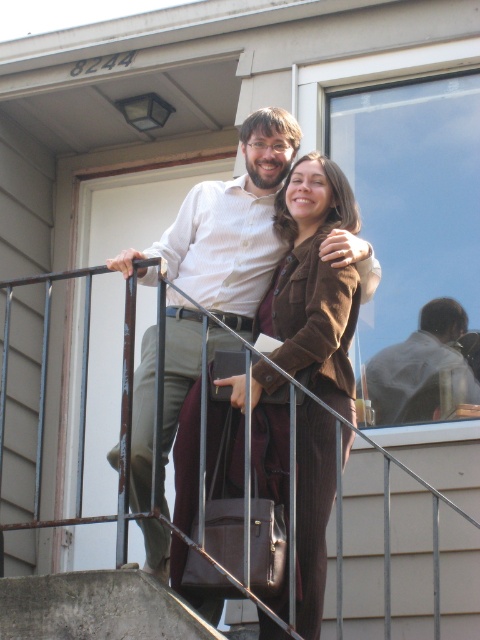
Question: Is brown woolen suit at center bigger than light brown leather jacket at upper right?

Choices:
 (A) no
 (B) yes

Answer: (B)

Question: Which of the following is the closest to the observer?

Choices:
 (A) (377, 483)
 (B) (322, 337)

Answer: (B)

Question: Which of the following is the closest to the observer?

Choices:
 (A) metallic gray railing at upper center
 (B) brown woolen suit at center

Answer: (A)

Question: Does brown woolen suit at center appear on the left side of light brown leather jacket at upper right?

Choices:
 (A) no
 (B) yes

Answer: (B)

Question: Observing the image, what is the correct spatial positioning of metallic gray railing at upper center in reference to brown woolen suit at center?

Choices:
 (A) below
 (B) above

Answer: (A)

Question: Among these points, which one is farthest from the camera?

Choices:
 (A) (392, 596)
 (B) (311, 186)
 (C) (417, 337)

Answer: (C)